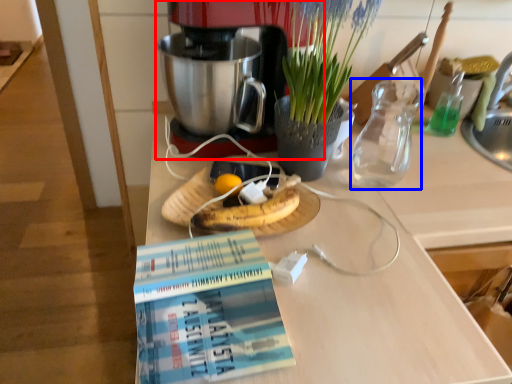
Question: Among these objects, which one is farthest to the camera, coffee maker (highlighted by a red box) or tea pot (highlighted by a blue box)?

Choices:
 (A) coffee maker
 (B) tea pot

Answer: (B)